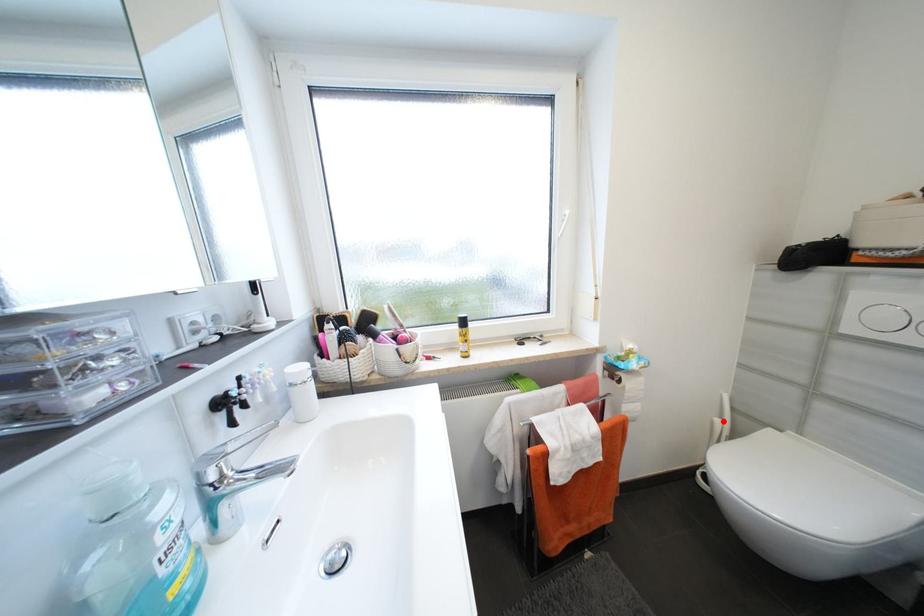
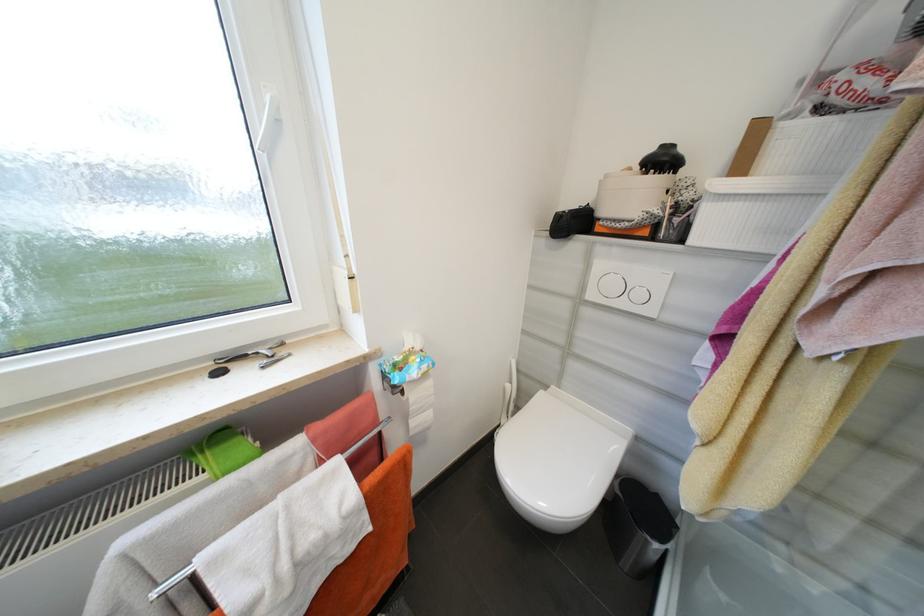
Locate, in the second image, the point that corresponds to the highlighted location in the first image.

(514, 387)